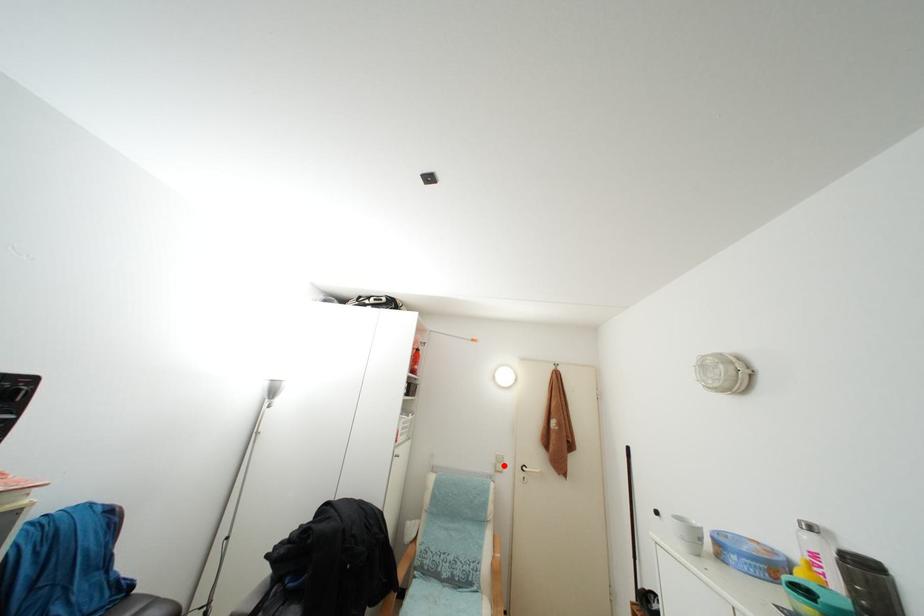
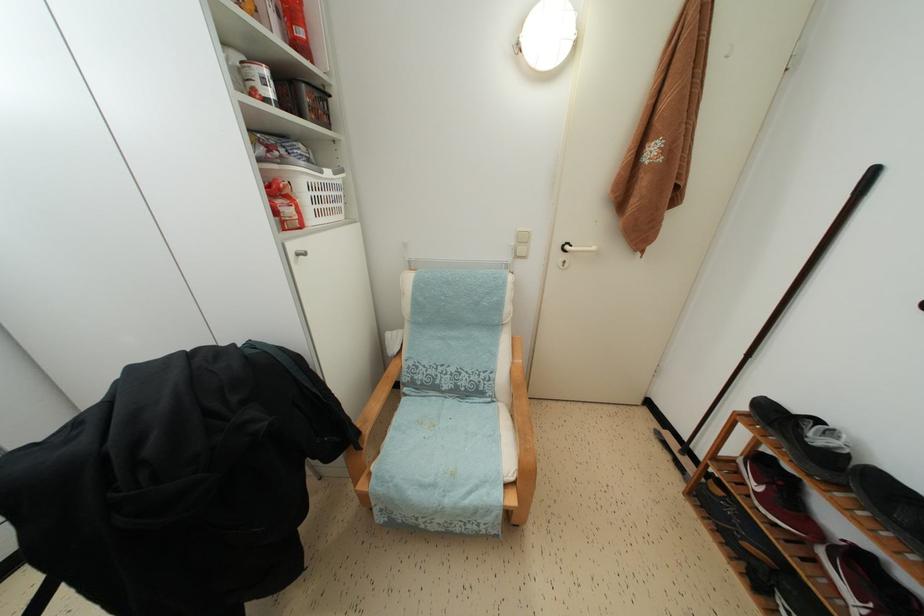
The point at the highlighted location is marked in the first image. Where is the corresponding point in the second image?

(527, 245)